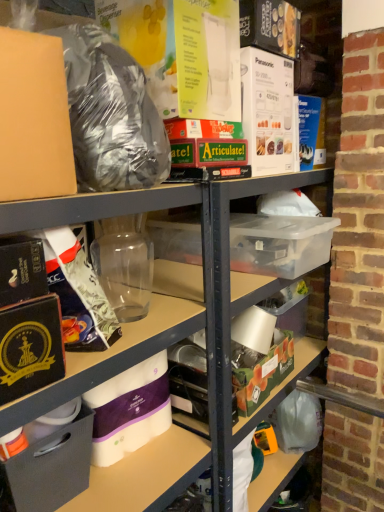
What is the approximate width of green matte box at center, acting as the 1th box starting from the right?

The width of green matte box at center, acting as the 1th box starting from the right, is 6.98 inches.

What do you see at coordinates (130, 410) in the screenshot? The image size is (384, 512). I see `white matte toilet paper at lower center` at bounding box center [130, 410].

What do you see at coordinates (111, 114) in the screenshot?
I see `matte black bag at upper left` at bounding box center [111, 114].

Where is `matte black bag at upper left`? matte black bag at upper left is located at coordinates (111, 114).

This screenshot has height=512, width=384. What are the coordinates of `matte black box at lower left, positioned as the second box in right-to-left order` in the screenshot? It's located at (49, 469).

Where is `green matte box at center, positioned as the 2th box in left-to-right order`? The image size is (384, 512). green matte box at center, positioned as the 2th box in left-to-right order is located at coordinates (260, 370).

From the image's perspective, is matte black bag at upper left located above white matte toilet paper at lower center?

Yes, from the image's perspective, matte black bag at upper left is above white matte toilet paper at lower center.

Considering the relative sizes of matte black bag at upper left and white matte toilet paper at lower center in the image provided, is matte black bag at upper left smaller than white matte toilet paper at lower center?

No, matte black bag at upper left is not smaller than white matte toilet paper at lower center.

Choose the correct answer: Is matte black bag at upper left inside white matte toilet paper at lower center or outside it?

matte black bag at upper left is not enclosed by white matte toilet paper at lower center.

Can you tell me how much matte black bag at upper left and white matte toilet paper at lower center differ in facing direction?

There is a 0.979-degree angle between the facing directions of matte black bag at upper left and white matte toilet paper at lower center.

Is matte black box at lower left, positioned as the second box in right-to-left order, to the right of matte black bag at upper left from the viewer's perspective?

No, matte black box at lower left, positioned as the second box in right-to-left order, is not to the right of matte black bag at upper left.

Considering the sizes of objects matte black box at lower left, marked as the first box in a left-to-right arrangement, and matte black bag at upper left in the image provided, who is thinner, matte black box at lower left, marked as the first box in a left-to-right arrangement, or matte black bag at upper left?

matte black bag at upper left.

Identify the location of waste that is in front of the matte black box at lower left, marked as the first box in a left-to-right arrangement. tap(111, 114).

From the image's perspective, between matte black box at lower left, which ranks as the first box in front-to-back order, and matte black bag at upper left, which one is located above?

matte black bag at upper left.

Is white matte toilet paper at lower center taller than green matte box at center, acting as the 1th box starting from the right?

Yes, white matte toilet paper at lower center is taller than green matte box at center, acting as the 1th box starting from the right.

Does white matte toilet paper at lower center turn towards green matte box at center, acting as the 1th box starting from the right?

No, white matte toilet paper at lower center is not facing towards green matte box at center, acting as the 1th box starting from the right.

From the image's perspective, is white matte toilet paper at lower center above or below green matte box at center, the 1th box viewed from the back?

white matte toilet paper at lower center is situated lower than green matte box at center, the 1th box viewed from the back, in the image.

Which is in front, white matte toilet paper at lower center or green matte box at center, positioned as the 2th box in left-to-right order?

white matte toilet paper at lower center is closer to the camera.

Which point is more distant from viewer, (155, 121) or (261, 372)?

The point (261, 372) is farther.

Does matte black bag at upper left have a larger size compared to green matte box at center, acting as the 1th box starting from the right?

Indeed, matte black bag at upper left has a larger size compared to green matte box at center, acting as the 1th box starting from the right.

Is matte black bag at upper left at the left side of green matte box at center, positioned as the 2th box in left-to-right order?

Correct, you'll find matte black bag at upper left to the left of green matte box at center, positioned as the 2th box in left-to-right order.

Is matte black bag at upper left positioned beyond the bounds of green matte box at center, acting as the 1th box starting from the right?

Yes, matte black bag at upper left is outside of green matte box at center, acting as the 1th box starting from the right.

Could you tell me if matte black bag at upper left is facing matte black box at lower left, positioned as the second box in right-to-left order?

No, matte black bag at upper left is not turned towards matte black box at lower left, positioned as the second box in right-to-left order.

From the image's perspective, is matte black bag at upper left located above or below matte black box at lower left, arranged as the 2th box when viewed from the back?

From the image's perspective, matte black bag at upper left appears above matte black box at lower left, arranged as the 2th box when viewed from the back.

You are a GUI agent. You are given a task and a screenshot of the screen. Output one action in this format:
    pyautogui.click(x=<x>, y=<y>)
    Task: Click on the waste above the matte black box at lower left, positioned as the second box in right-to-left order (from a real-world perspective)
    This screenshot has height=512, width=384.
    Given the screenshot: What is the action you would take?
    pyautogui.click(x=111, y=114)

Considering the sizes of objects matte black bag at upper left and matte black box at lower left, marked as the first box in a left-to-right arrangement, in the image provided, who is bigger, matte black bag at upper left or matte black box at lower left, marked as the first box in a left-to-right arrangement,?

Bigger between the two is matte black bag at upper left.

Do you think green matte box at center, which ranks as the second box in front-to-back order, is within white matte toilet paper at lower center, or outside of it?

green matte box at center, which ranks as the second box in front-to-back order, cannot be found inside white matte toilet paper at lower center.

Looking at this image, from a real-world perspective, who is located lower, green matte box at center, the 1th box viewed from the back, or white matte toilet paper at lower center?

green matte box at center, the 1th box viewed from the back.

Considering the sizes of objects green matte box at center, which ranks as the second box in front-to-back order, and white matte toilet paper at lower center in the image provided, who is bigger, green matte box at center, which ranks as the second box in front-to-back order, or white matte toilet paper at lower center?

green matte box at center, which ranks as the second box in front-to-back order, is bigger.

In the scene shown: From the image's perspective, is green matte box at center, the 1th box viewed from the back, above white matte toilet paper at lower center?

Yes, from the image's perspective, green matte box at center, the 1th box viewed from the back, is above white matte toilet paper at lower center.

Could you tell me if white matte toilet paper at lower center is facing matte black box at lower left, arranged as the 2th box when viewed from the back?

No, white matte toilet paper at lower center is not facing towards matte black box at lower left, arranged as the 2th box when viewed from the back.

Which object is closer to the camera taking this photo, white matte toilet paper at lower center or matte black box at lower left, arranged as the 2th box when viewed from the back?

matte black box at lower left, arranged as the 2th box when viewed from the back, is closer to the camera.

From the image's perspective, which is above, white matte toilet paper at lower center or matte black box at lower left, marked as the first box in a left-to-right arrangement?

From the image's view, white matte toilet paper at lower center is above.

Where is `waste on the left of white matte toilet paper at lower center`? Image resolution: width=384 pixels, height=512 pixels. waste on the left of white matte toilet paper at lower center is located at coordinates (111, 114).

Where is `waste on the right of the matte black box at lower left, positioned as the second box in right-to-left order`? waste on the right of the matte black box at lower left, positioned as the second box in right-to-left order is located at coordinates (111, 114).

Looking at the image, which one is located further to matte black box at lower left, marked as the first box in a left-to-right arrangement, matte black bag at upper left or green matte box at center, acting as the 1th box starting from the right?

matte black bag at upper left.

Estimate the real-world distances between objects in this image. Which object is further from matte black box at lower left, marked as the first box in a left-to-right arrangement, white matte toilet paper at lower center or matte black bag at upper left?

matte black bag at upper left is further to matte black box at lower left, marked as the first box in a left-to-right arrangement.

Which object lies further to the anchor point green matte box at center, acting as the 1th box starting from the right, matte black bag at upper left or white matte toilet paper at lower center?

matte black bag at upper left.

Estimate the real-world distances between objects in this image. Which object is further from white matte toilet paper at lower center, green matte box at center, positioned as the 2th box in left-to-right order, or matte black bag at upper left?

Based on the image, matte black bag at upper left appears to be further to white matte toilet paper at lower center.

Based on their spatial positions, is matte black bag at upper left or matte black box at lower left, which ranks as the first box in front-to-back order, further from green matte box at center, acting as the 1th box starting from the right?

Based on the image, matte black bag at upper left appears to be further to green matte box at center, acting as the 1th box starting from the right.

From the image, which object appears to be nearer to matte black box at lower left, arranged as the 2th box when viewed from the back, green matte box at center, acting as the 1th box starting from the right, or white matte toilet paper at lower center?

white matte toilet paper at lower center lies closer to matte black box at lower left, arranged as the 2th box when viewed from the back, than the other object.

Looking at the image, which one is located further to green matte box at center, positioned as the 2th box in left-to-right order, white matte toilet paper at lower center or matte black box at lower left, which ranks as the first box in front-to-back order?

matte black box at lower left, which ranks as the first box in front-to-back order, is further to green matte box at center, positioned as the 2th box in left-to-right order.

Based on their spatial positions, is matte black box at lower left, positioned as the second box in right-to-left order, or white matte toilet paper at lower center further from green matte box at center, which ranks as the second box in front-to-back order?

The object further to green matte box at center, which ranks as the second box in front-to-back order, is matte black box at lower left, positioned as the second box in right-to-left order.

You are a GUI agent. You are given a task and a screenshot of the screen. Output one action in this format:
    pyautogui.click(x=<x>, y=<y>)
    Task: Click on the box between matte black bag at upper left and matte black box at lower left, arranged as the 2th box when viewed from the back, vertically
    Image resolution: width=384 pixels, height=512 pixels.
    Given the screenshot: What is the action you would take?
    pyautogui.click(x=260, y=370)

Locate an element on the screen. toilet paper between matte black bag at upper left and matte black box at lower left, which ranks as the first box in front-to-back order, from top to bottom is located at coordinates (130, 410).

Identify the location of toilet paper between matte black box at lower left, which ranks as the first box in front-to-back order, and green matte box at center, which ranks as the second box in front-to-back order. The image size is (384, 512). (130, 410).

This screenshot has height=512, width=384. I want to click on box between matte black bag at upper left and white matte toilet paper at lower center in the up-down direction, so click(260, 370).